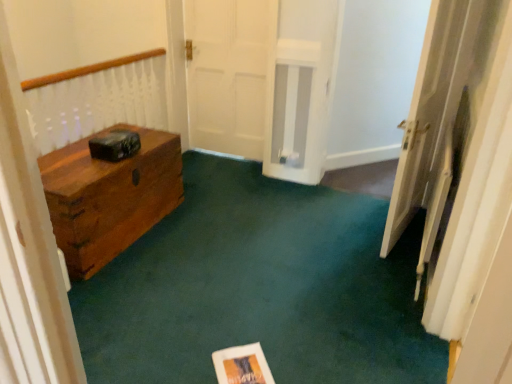
Question: Would you say matte paper at center is outside white wooden door at right?

Choices:
 (A) yes
 (B) no

Answer: (A)

Question: Is the depth of matte paper at center greater than that of white wooden door at right?

Choices:
 (A) no
 (B) yes

Answer: (A)

Question: From the image's perspective, does matte paper at center appear lower than white wooden door at right?

Choices:
 (A) no
 (B) yes

Answer: (B)

Question: Considering the relative sizes of matte paper at center and white wooden door at right in the image provided, is matte paper at center taller than white wooden door at right?

Choices:
 (A) no
 (B) yes

Answer: (A)

Question: Is the depth of matte paper at center less than that of white wooden door at right?

Choices:
 (A) yes
 (B) no

Answer: (A)

Question: From a real-world perspective, is matte paper at center beneath white wooden door at right?

Choices:
 (A) no
 (B) yes

Answer: (B)

Question: Does white wooden door at right come behind matte paper at center?

Choices:
 (A) yes
 (B) no

Answer: (A)

Question: From the image's perspective, is white wooden door at right over matte paper at center?

Choices:
 (A) no
 (B) yes

Answer: (B)

Question: Does white wooden door at right lie in front of matte paper at center?

Choices:
 (A) no
 (B) yes

Answer: (A)

Question: Does white wooden door at right have a lesser height compared to matte paper at center?

Choices:
 (A) yes
 (B) no

Answer: (B)

Question: Can you see white wooden door at right touching matte paper at center?

Choices:
 (A) yes
 (B) no

Answer: (B)

Question: Is white wooden door at right looking in the opposite direction of matte paper at center?

Choices:
 (A) no
 (B) yes

Answer: (A)

Question: In terms of height, does white wooden door at right look taller or shorter compared to matte paper at center?

Choices:
 (A) tall
 (B) short

Answer: (A)